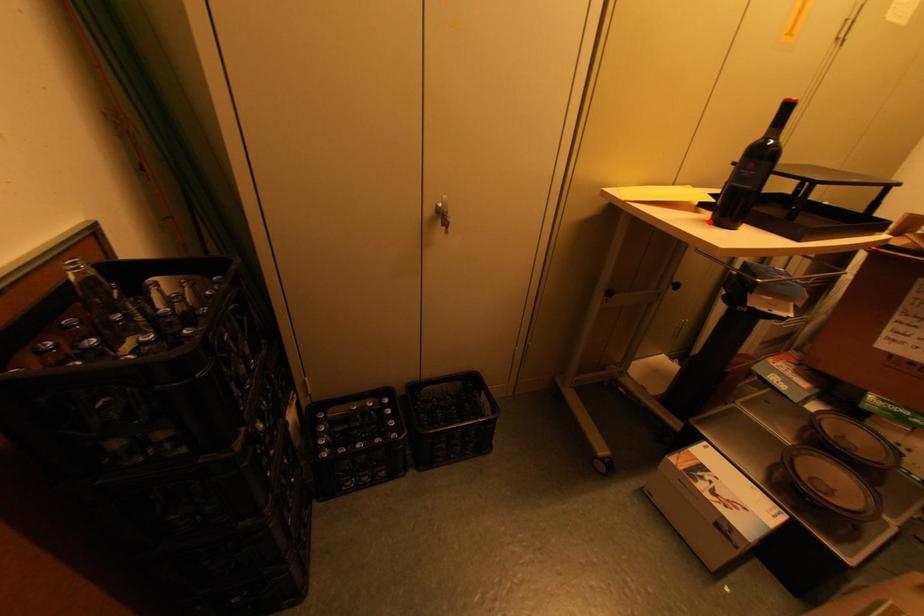
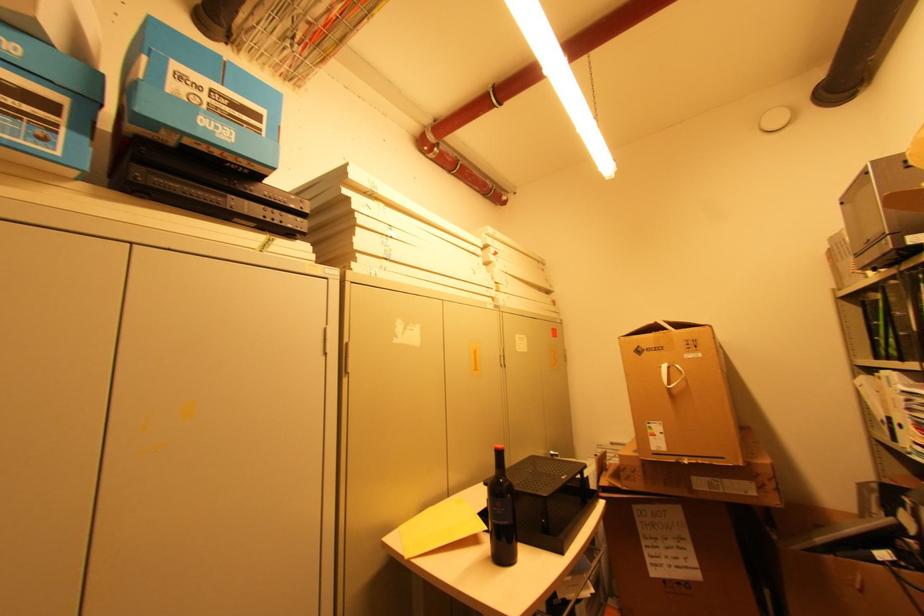
Where in the second image is the point corresponding to the highlighted location from the first image?

(492, 559)